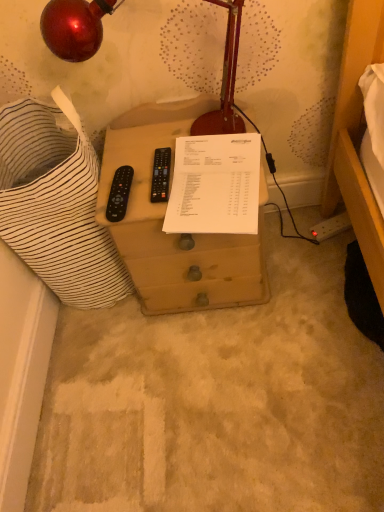
Question: From a real-world perspective, is white paper at center located beneath brown wooden drawer at center?

Choices:
 (A) no
 (B) yes

Answer: (A)

Question: Is the surface of white paper at center in direct contact with brown wooden drawer at center?

Choices:
 (A) yes
 (B) no

Answer: (B)

Question: Is white paper at center at the right side of brown wooden drawer at center?

Choices:
 (A) no
 (B) yes

Answer: (B)

Question: Is white paper at center smaller than brown wooden drawer at center?

Choices:
 (A) no
 (B) yes

Answer: (B)

Question: Is white paper at center positioned beyond the bounds of brown wooden drawer at center?

Choices:
 (A) yes
 (B) no

Answer: (B)

Question: Considering the positions of white paper at center and brown wooden drawer at center in the image, is white paper at center wider or thinner than brown wooden drawer at center?

Choices:
 (A) wide
 (B) thin

Answer: (B)

Question: From the image's perspective, is white paper at center located above or below brown wooden drawer at center?

Choices:
 (A) above
 (B) below

Answer: (A)

Question: From a real-world perspective, is white paper at center above or below brown wooden drawer at center?

Choices:
 (A) above
 (B) below

Answer: (A)

Question: Is white paper at center spatially inside brown wooden drawer at center, or outside of it?

Choices:
 (A) inside
 (B) outside

Answer: (A)

Question: From the image's perspective, is brown wooden drawer at center positioned above or below metallic red lamp at upper left?

Choices:
 (A) below
 (B) above

Answer: (A)

Question: Is brown wooden drawer at center inside the boundaries of metallic red lamp at upper left, or outside?

Choices:
 (A) inside
 (B) outside

Answer: (B)

Question: From a real-world perspective, relative to metallic red lamp at upper left, is brown wooden drawer at center vertically above or below?

Choices:
 (A) below
 (B) above

Answer: (A)

Question: Relative to metallic red lamp at upper left, is brown wooden drawer at center in front or behind?

Choices:
 (A) behind
 (B) front

Answer: (A)

Question: Is metallic red lamp at upper left to the left or to the right of brown wooden drawer at center in the image?

Choices:
 (A) left
 (B) right

Answer: (A)

Question: Is metallic red lamp at upper left inside the boundaries of brown wooden drawer at center, or outside?

Choices:
 (A) inside
 (B) outside

Answer: (B)